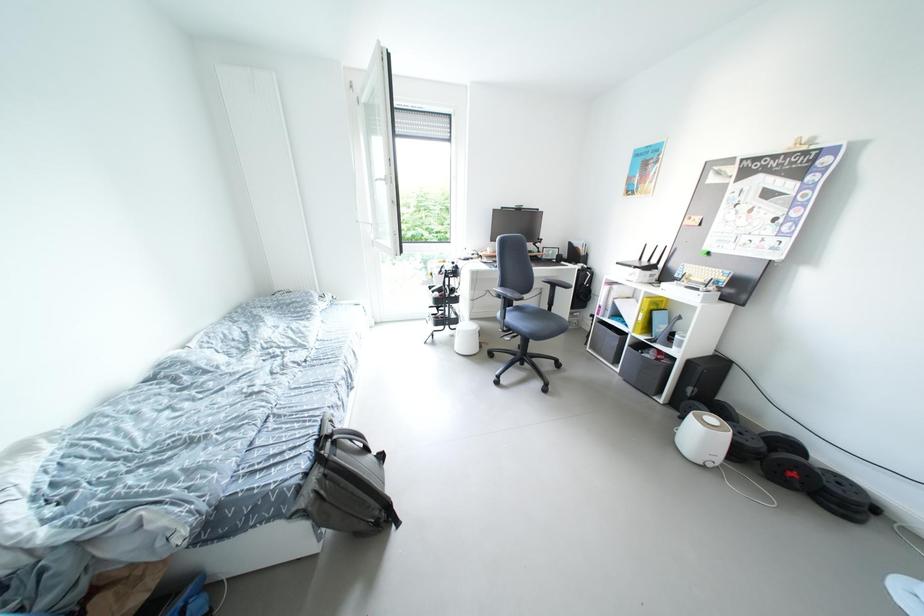
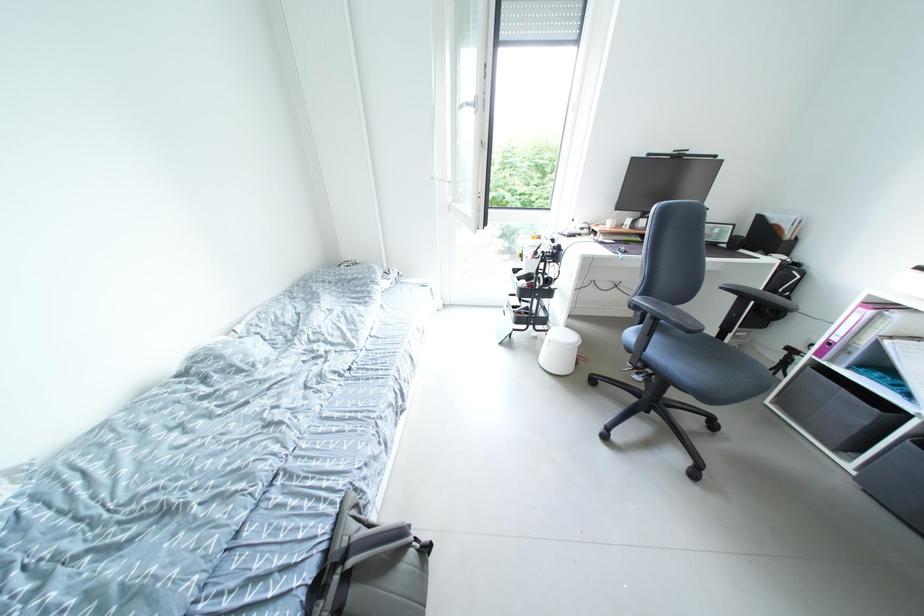
Question: The images are taken continuously from a first-person perspective. In which direction is your viewpoint rotating?

Choices:
 (A) Left
 (B) Right
 (C) Up
 (D) Down

Answer: (A)